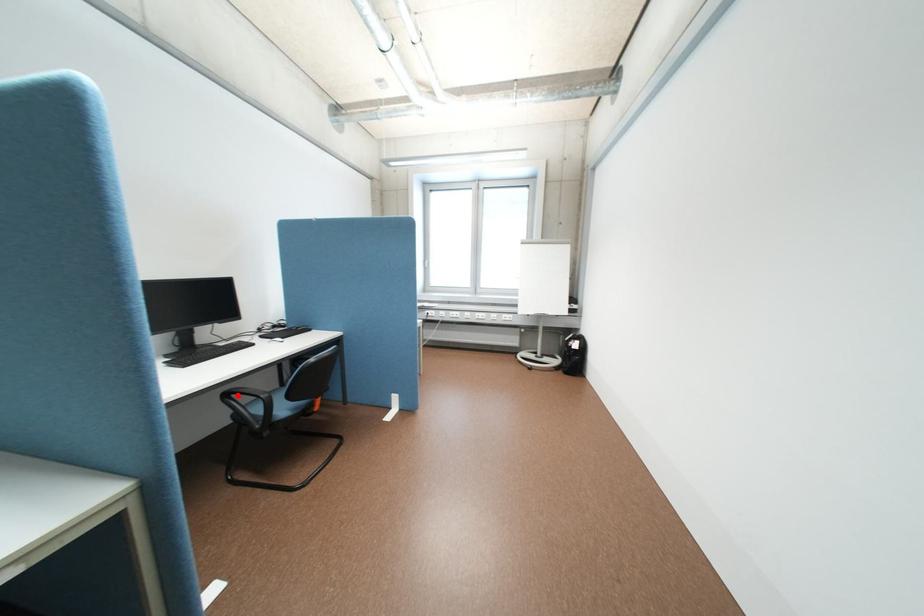
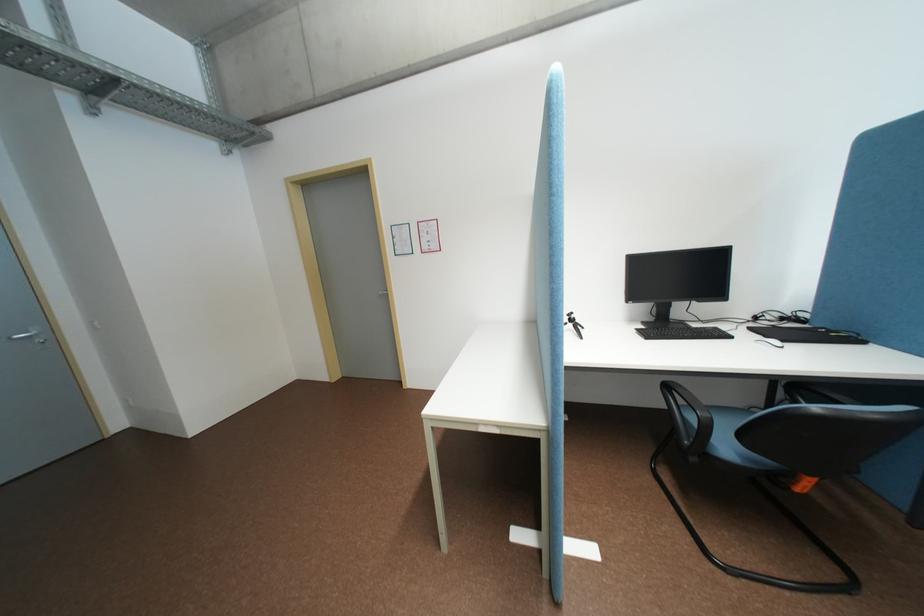
Question: A red point is marked in image1. In image2, is the corresponding 3D point closer to the camera or farther? Reply with the corresponding letter.

Choices:
 (A) The corresponding 3D point is closer.
 (B) The corresponding 3D point is farther.

Answer: (B)